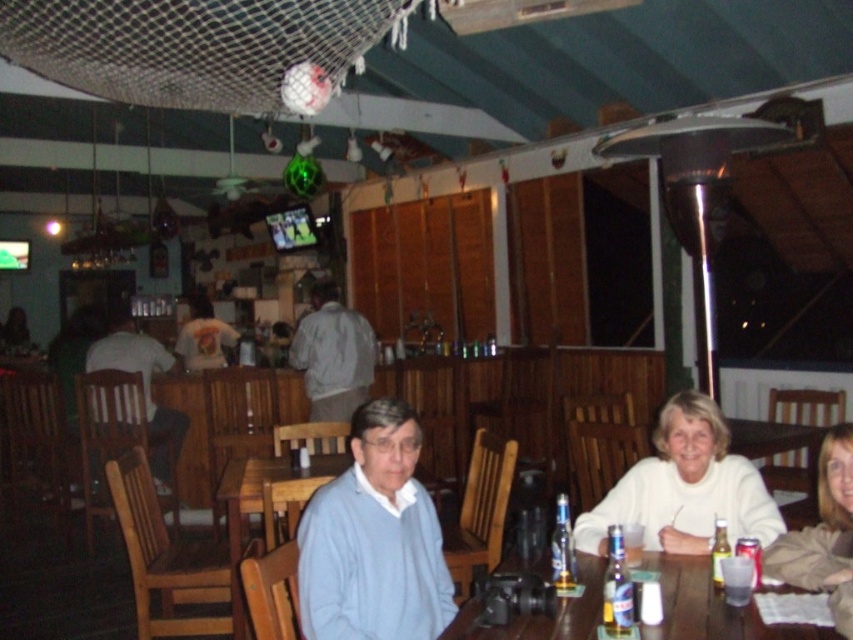
Does light brown leather jacket at center have a greater height compared to clear glass bottle at table right?

Correct, light brown leather jacket at center is much taller as clear glass bottle at table right.

Is light brown leather jacket at center shorter than clear glass bottle at table right?

Incorrect, light brown leather jacket at center's height does not fall short of clear glass bottle at table right's.

Which is behind, point (223, 333) or point (610, 531)?

Point (223, 333)

I want to click on light brown leather jacket at center, so click(202, 336).

Does point (720, 602) lie behind point (560, 538)?

No, (720, 602) is closer to viewer.

From the picture: Can you confirm if wooden table at center is positioned to the left of clear glass bottle at table center?

Incorrect, wooden table at center is not on the left side of clear glass bottle at table center.

This screenshot has height=640, width=853. Describe the element at coordinates (711, 608) in the screenshot. I see `wooden table at center` at that location.

Where is `wooden table at center`? The image size is (853, 640). wooden table at center is located at coordinates (711, 608).

Which is behind, point (654, 429) or point (840, 525)?

Positioned behind is point (654, 429).

Based on the photo, can you confirm if white matte sweater at lower right is positioned below light brown hair at lower right?

Correct, white matte sweater at lower right is located below light brown hair at lower right.

Is point (695, 410) in front of point (822, 484)?

No, (695, 410) is behind (822, 484).

Locate an element on the screen. white matte sweater at lower right is located at coordinates (683, 486).